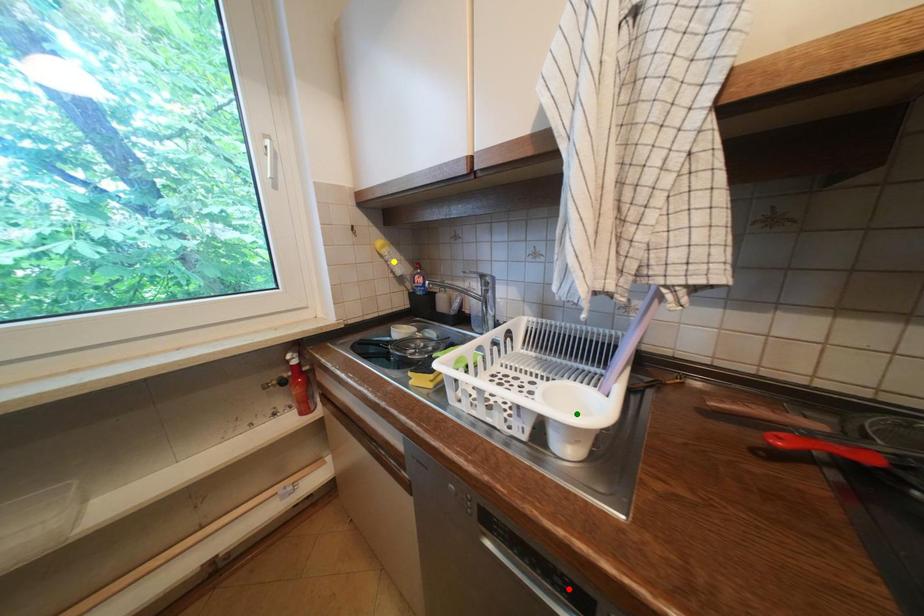
Order these from nearest to farthest:
yellow point, red point, green point

red point → green point → yellow point